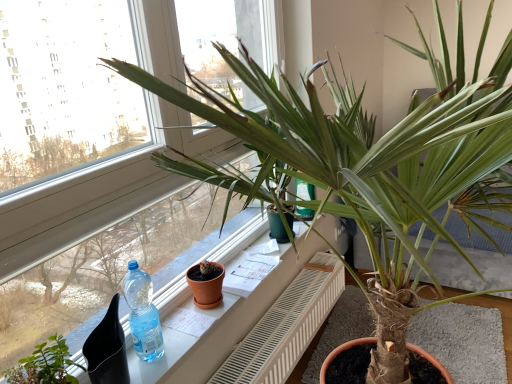
Find the location of a particular element. This screenshot has width=512, height=384. white glossy window sill at center is located at coordinates (256, 302).

What is the approximate width of terracotta clay pot at center?

terracotta clay pot at center is 5.76 inches in width.

Find the location of `white plastic radiator at center`. white plastic radiator at center is located at coordinates (286, 326).

Measure the distance between green leafy plant at upper center and camera.

green leafy plant at upper center and camera are 37.68 inches apart from each other.

You are a GUI agent. You are given a task and a screenshot of the screen. Output one action in this format:
    pyautogui.click(x=<x>, y=<y>)
    Task: Click on the transparent plastic bottle at window
    The height and width of the screenshot is (384, 512).
    Given the screenshot: What is the action you would take?
    tap(142, 313)

Image resolution: width=512 pixels, height=384 pixels. What do you see at coordinates (45, 365) in the screenshot?
I see `green matte plant at lower left` at bounding box center [45, 365].

Where is `white glossy window sill at center`? The height and width of the screenshot is (384, 512). white glossy window sill at center is located at coordinates (256, 302).

Does green leafy plant at upper center turn towards white plastic radiator at center?

No, green leafy plant at upper center does not turn towards white plastic radiator at center.

At what (x,y) coordinates should I click in order to perform the action: click on window located above the white plastic radiator at center (from a real-world perspective). Please return your answer as a coordinate pair (x, y). The width and height of the screenshot is (512, 384). Looking at the image, I should click on click(x=94, y=182).

Looking at this image, between green leafy plant at upper center and white plastic radiator at center, which one has larger width?

green leafy plant at upper center.

From the image's perspective, is white glossy window sill at center on top of green matte plant at lower left?

Yes.

Based on the photo, how distant is white glossy window sill at center from green matte plant at lower left?

white glossy window sill at center and green matte plant at lower left are 23.56 inches apart.

Is white glossy window sill at center to the right of green matte plant at lower left from the viewer's perspective?

Yes, white glossy window sill at center is to the right of green matte plant at lower left.

Which of these two, white glossy window sill at center or green matte plant at lower left, is wider?

Wider between the two is white glossy window sill at center.

From the image's perspective, between green leafy plant at upper center and green matte plant at lower left, which one is located above?

green leafy plant at upper center appears higher in the image.

The width and height of the screenshot is (512, 384). Identify the location of window that is on the right side of green matte plant at lower left. (94, 182).

Is green leafy plant at upper center touching green matte plant at lower left?

No.

Considering the relative sizes of green leafy plant at upper center and transparent plastic bottle at window in the image provided, is green leafy plant at upper center taller than transparent plastic bottle at window?

Correct, green leafy plant at upper center is much taller as transparent plastic bottle at window.

Image resolution: width=512 pixels, height=384 pixels. I want to click on window on the right of the transparent plastic bottle at window, so click(94, 182).

Relative to transparent plastic bottle at window, is green leafy plant at upper center in front or behind?

Clearly, green leafy plant at upper center is in front of transparent plastic bottle at window.

Between white glossy window sill at center and green leafy plant at upper center, which one is positioned in front?

green leafy plant at upper center is closer to the camera.

Considering the positions of point (123, 325) and point (35, 156), is point (123, 325) closer or farther from the camera than point (35, 156)?

Point (123, 325) is positioned closer to the camera compared to point (35, 156).

Looking at this image, measure the distance from white glossy window sill at center to green leafy plant at upper center.

A distance of 23.90 inches exists between white glossy window sill at center and green leafy plant at upper center.

From the image's perspective, would you say white glossy window sill at center is shown under green leafy plant at upper center?

Yes, from the image's perspective, white glossy window sill at center is beneath green leafy plant at upper center.

Between white glossy window sill at center and white plastic radiator at center, which one appears on the left side from the viewer's perspective?

Positioned to the left is white glossy window sill at center.

Identify the location of window sill in front of the white plastic radiator at center. (256, 302).

Would you consider white glossy window sill at center to be distant from white plastic radiator at center?

Actually, white glossy window sill at center and white plastic radiator at center are a little close together.

Where is `bottle above the terracotta clay pot at center (from a real-world perspective)`? This screenshot has width=512, height=384. bottle above the terracotta clay pot at center (from a real-world perspective) is located at coordinates (142, 313).

Considering the positions of objects transparent plastic bottle at window and terracotta clay pot at center in the image provided, who is in front, transparent plastic bottle at window or terracotta clay pot at center?

transparent plastic bottle at window.

Which of these two, transparent plastic bottle at window or terracotta clay pot at center, is smaller?

With smaller size is terracotta clay pot at center.

From the picture: From a real-world perspective, is transparent plastic bottle at window below terracotta clay pot at center?

No, from a real-world perspective, transparent plastic bottle at window is not below terracotta clay pot at center.

This screenshot has height=384, width=512. I want to click on radiator on the right of the green leafy plant at upper center, so click(286, 326).

Locate an element on the screen. This screenshot has height=384, width=512. houseplant in front of the white glossy window sill at center is located at coordinates (45, 365).

Based on their spatial positions, is green leafy plant at upper center or white plastic radiator at center further from transparent plastic bottle at window?

white plastic radiator at center lies further to transparent plastic bottle at window than the other object.

Estimate the real-world distances between objects in this image. Which object is further from green leafy plant at upper center, white plastic radiator at center or white glossy window sill at center?

Among the two, white plastic radiator at center is located further to green leafy plant at upper center.

Looking at the image, which one is located closer to white glossy window sill at center, green leafy plant at upper center or white plastic radiator at center?

white plastic radiator at center lies closer to white glossy window sill at center than the other object.

Looking at the image, which one is located further to green leafy plant at upper center, white glossy window sill at center or white plastic radiator at center?

white plastic radiator at center lies further to green leafy plant at upper center than the other object.

Estimate the real-world distances between objects in this image. Which object is further from white glossy window sill at center, transparent plastic bottle at window or terracotta clay pot at center?

transparent plastic bottle at window is further to white glossy window sill at center.

Based on their spatial positions, is green leafy plant at upper center or green matte plant at lower left further from transparent plastic bottle at window?

green leafy plant at upper center is further to transparent plastic bottle at window.

From the image, which object appears to be farther from green leafy plant at upper center, green matte plant at lower left or terracotta clay pot at center?

green matte plant at lower left.

Based on their spatial positions, is green matte plant at lower left or green leafy plant at upper center further from transparent plastic bottle at window?

green leafy plant at upper center.

I want to click on bottle between green leafy plant at upper center and green matte plant at lower left in the up-down direction, so click(x=142, y=313).

Locate an element on the screen. This screenshot has width=512, height=384. bottle located between green leafy plant at upper center and terracotta clay pot at center in the depth direction is located at coordinates (142, 313).

Identify the location of window sill between green leafy plant at upper center and green matte plant at lower left vertically. (256, 302).

This screenshot has width=512, height=384. I want to click on window sill between transparent plastic bottle at window and white plastic radiator at center from left to right, so click(256, 302).